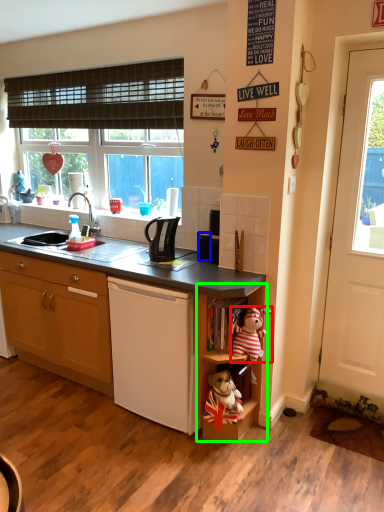
Question: Estimate the real-world distances between objects in this image. Which object is closer to toy (highlighted by a red box), appliance (highlighted by a blue box) or shelf (highlighted by a green box)?

Choices:
 (A) appliance
 (B) shelf

Answer: (B)